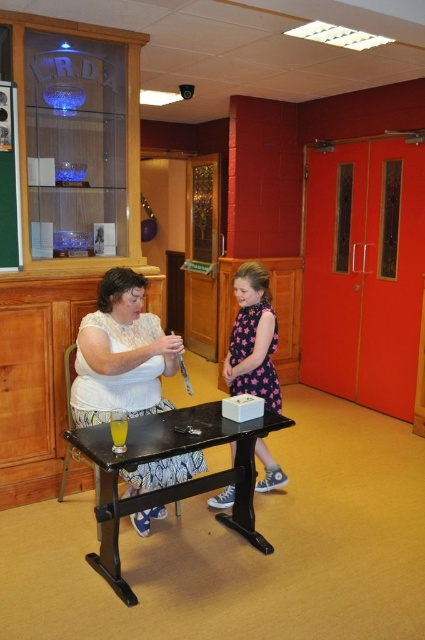
Does point (136, 476) come in front of point (246, 362)?

That is True.

Who is lower down, white matte dress at center or pink dotted dress at center?

white matte dress at center is below.

You are a GUI agent. You are given a task and a screenshot of the screen. Output one action in this format:
    pyautogui.click(x=<x>, y=<y>)
    Task: Click on the white matte dress at center
    This screenshot has height=640, width=425.
    Given the screenshot: What is the action you would take?
    pyautogui.click(x=121, y=355)

Which is below, white matte dress at center or black wood table at center?

Positioned lower is black wood table at center.

Between white matte dress at center and black wood table at center, which one is positioned higher?

Positioned higher is white matte dress at center.

The width and height of the screenshot is (425, 640). What are the coordinates of `white matte dress at center` in the screenshot? It's located at (121, 355).

Who is shorter, pink dotted dress at center or green matte bulletin board at left?

With less height is pink dotted dress at center.

Can you confirm if pink dotted dress at center is positioned below green matte bulletin board at left?

Correct, pink dotted dress at center is located below green matte bulletin board at left.

At what (x,y) coordinates should I click in order to perform the action: click on pink dotted dress at center. Please return your answer as a coordinate pair (x, y). Looking at the image, I should click on (252, 339).

Find the location of `pink dotted dress at center`. pink dotted dress at center is located at coordinates [x=252, y=339].